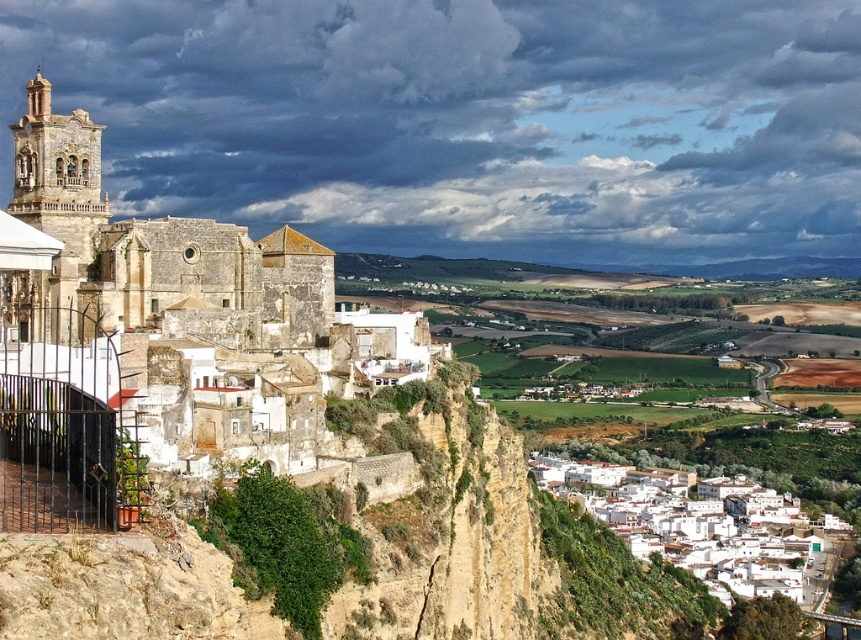
Find the location of `white matte buildings at lower right`. white matte buildings at lower right is located at coordinates (698, 524).

Is white matte buildings at lower right behind light beige stone tower at left?

That is True.

Does point (763, 550) come farther from viewer compared to point (56, 179)?

Yes, point (763, 550) is behind point (56, 179).

What are the coordinates of `white matte buildings at lower right` in the screenshot? It's located at (698, 524).

Which is more to the right, stone church at left or light beige stone tower at left?

From the viewer's perspective, stone church at left appears more on the right side.

Between stone church at left and light beige stone tower at left, which one appears on the left side from the viewer's perspective?

light beige stone tower at left

Locate an element on the screen. stone church at left is located at coordinates (187, 316).

Locate an element on the screen. The height and width of the screenshot is (640, 861). stone church at left is located at coordinates (187, 316).

Is point (72, 305) positioned in front of point (552, 464)?

Yes, it is in front of point (552, 464).

Image resolution: width=861 pixels, height=640 pixels. I want to click on stone church at left, so [x=187, y=316].